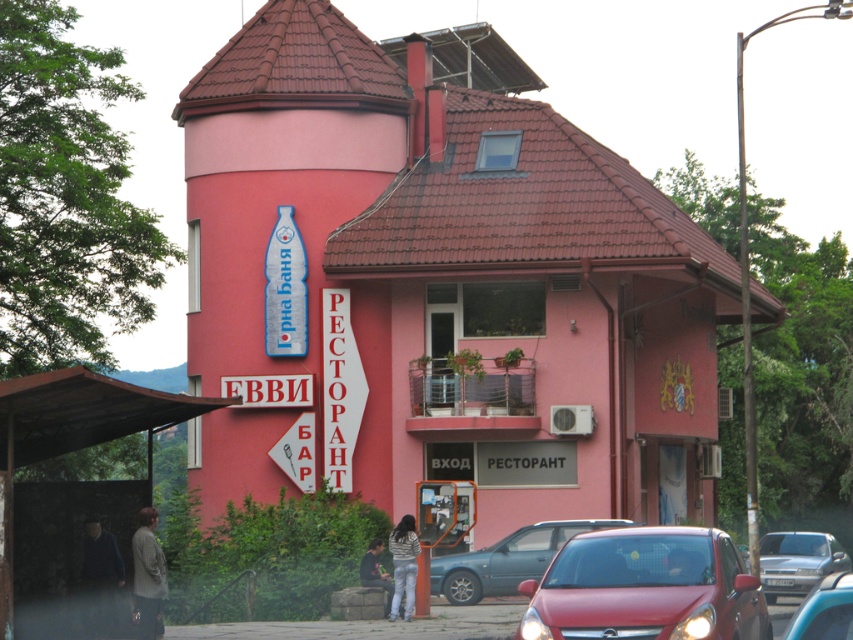
Who is higher up, shiny red car at lower right or light brown fabric jacket at lower left?

shiny red car at lower right is higher up.

I want to click on shiny red car at lower right, so click(x=645, y=588).

This screenshot has width=853, height=640. I want to click on shiny red car at lower right, so click(645, 588).

Does matte pink building at center appear under shiny red car at lower right?

Actually, matte pink building at center is above shiny red car at lower right.

Can you confirm if matte pink building at center is positioned to the left of shiny red car at lower right?

In fact, matte pink building at center is to the right of shiny red car at lower right.

Does point (422, 452) come farther from viewer compared to point (683, 582)?

Yes, it is.

The width and height of the screenshot is (853, 640). What are the coordinates of `matte pink building at center` in the screenshot? It's located at (436, 284).

Between shiny red car at lower right and dark green fabric jacket at lower center, which one has more height?

With more height is dark green fabric jacket at lower center.

Is point (590, 592) positioned behind point (369, 573)?

No, it is in front of (369, 573).

Which is in front, point (692, 528) or point (370, 547)?

Point (692, 528) is more forward.

Locate an element on the screen. shiny red car at lower right is located at coordinates (645, 588).